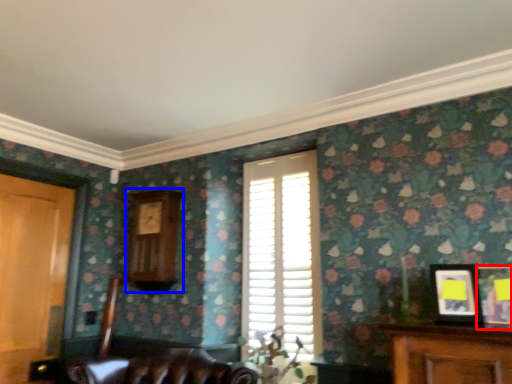
Question: Which object appears farthest to the camera in this image, picture frame (highlighted by a red box) or clock (highlighted by a blue box)?

Choices:
 (A) picture frame
 (B) clock

Answer: (B)